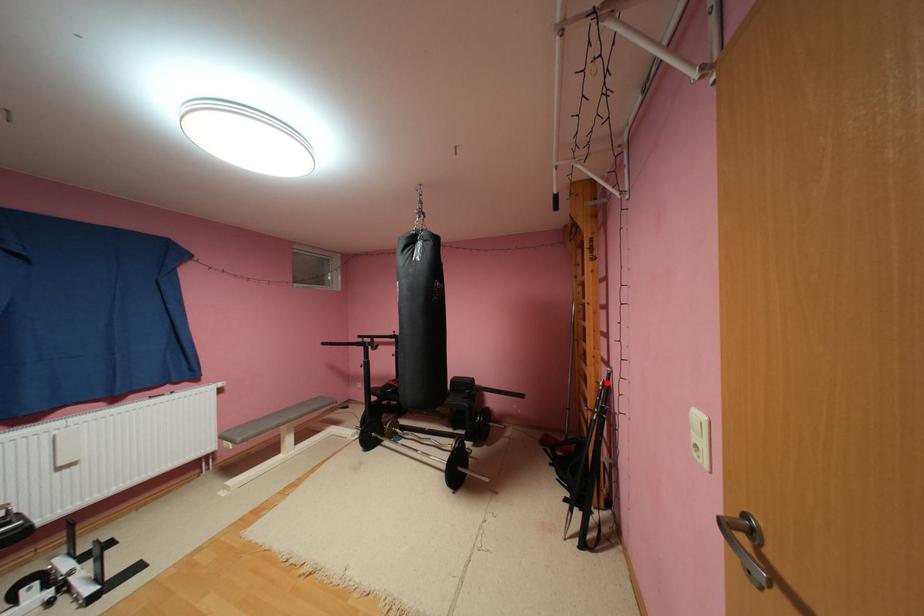
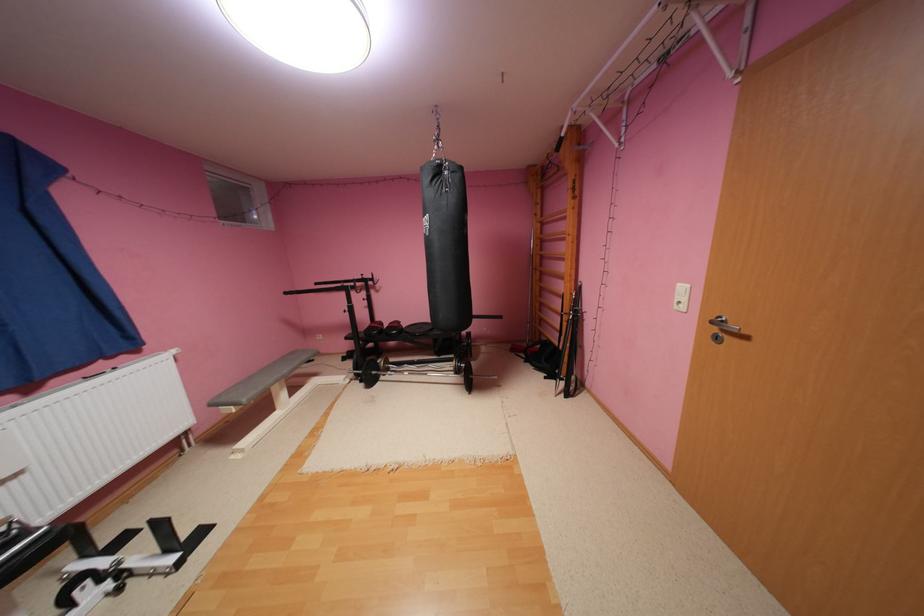
Find the pixel in the second image that matches the highlighted location in the first image.

(580, 294)